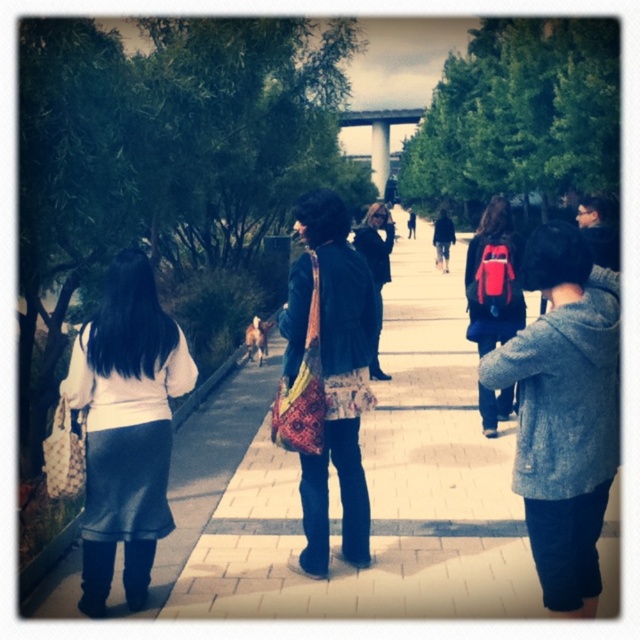
Between brick pavement at center and matte white sweater at left, which one has less height?

matte white sweater at left

Does brick pavement at center have a lesser height compared to matte white sweater at left?

No.

Does point (220, 524) come closer to viewer compared to point (131, 442)?

No, (220, 524) is further to viewer.

The height and width of the screenshot is (640, 640). What are the coordinates of `brick pavement at center` in the screenshot? It's located at (384, 493).

Does gray woolen jacket at right have a greater height compared to patterned fabric bag at center?

No, gray woolen jacket at right is not taller than patterned fabric bag at center.

Is gray woolen jacket at right to the right of patterned fabric bag at center from the viewer's perspective?

No, gray woolen jacket at right is not to the right of patterned fabric bag at center.

Is point (560, 250) positioned before point (380, 212)?

Yes, point (560, 250) is in front of point (380, 212).

The width and height of the screenshot is (640, 640). Find the location of `gray woolen jacket at right`. gray woolen jacket at right is located at coordinates (564, 413).

Can you confirm if brick pavement at center is positioned to the right of matte red backpack at center-right?

Incorrect, brick pavement at center is not on the right side of matte red backpack at center-right.

Does brick pavement at center have a lesser width compared to matte red backpack at center-right?

In fact, brick pavement at center might be wider than matte red backpack at center-right.

This screenshot has width=640, height=640. In order to click on brick pavement at center in this screenshot , I will do pyautogui.click(x=384, y=493).

The image size is (640, 640). What are the coordinates of `brick pavement at center` in the screenshot? It's located at (384, 493).